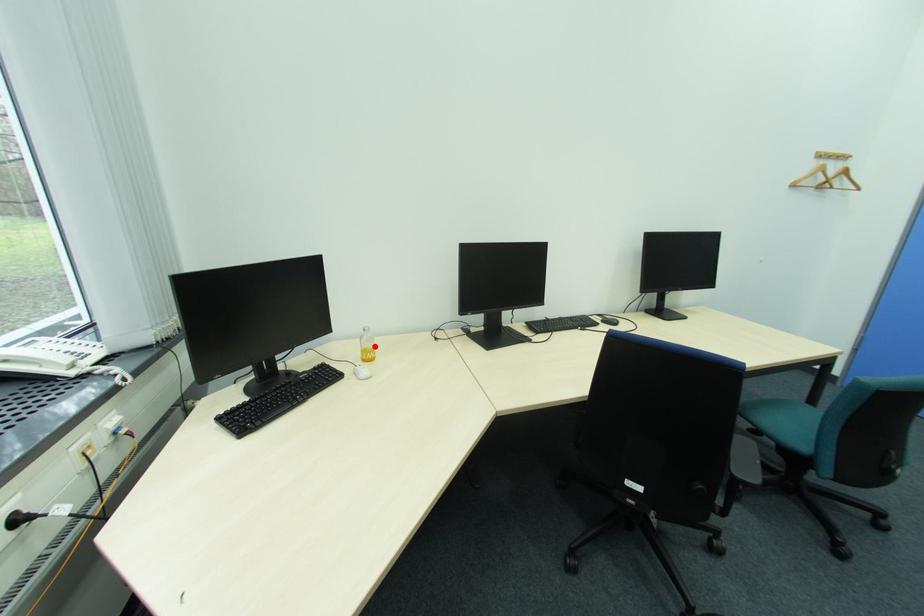
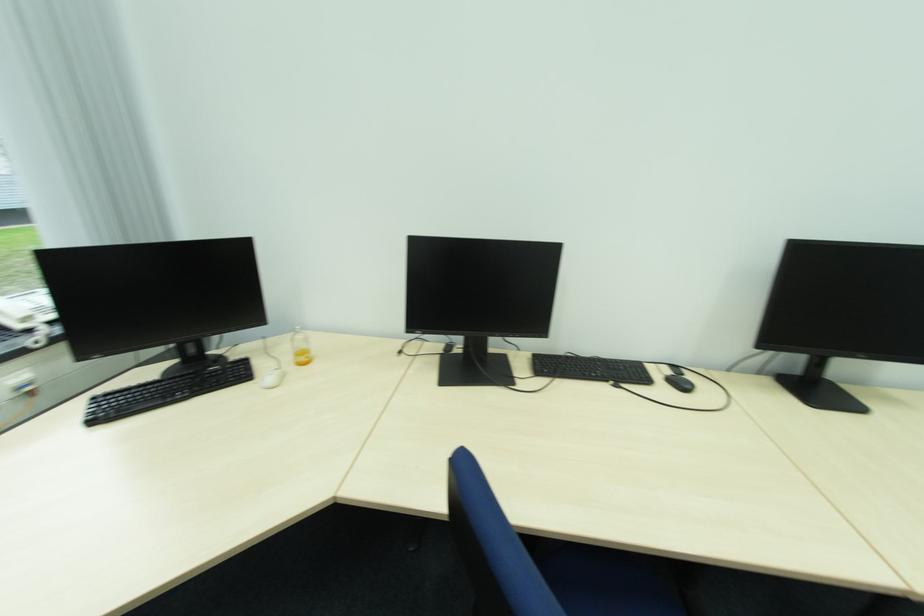
The point at the highlighted location is marked in the first image. Where is the corresponding point in the second image?

(310, 347)